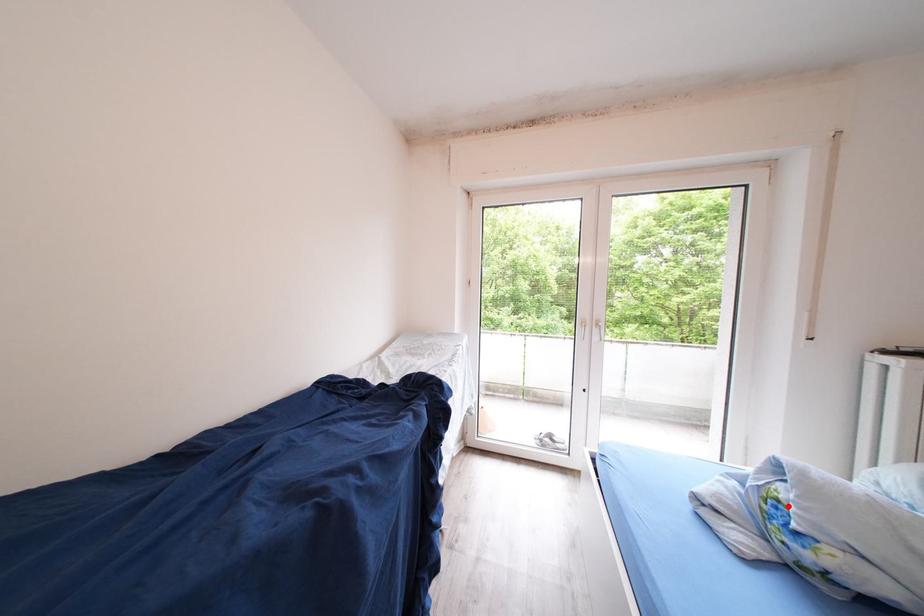
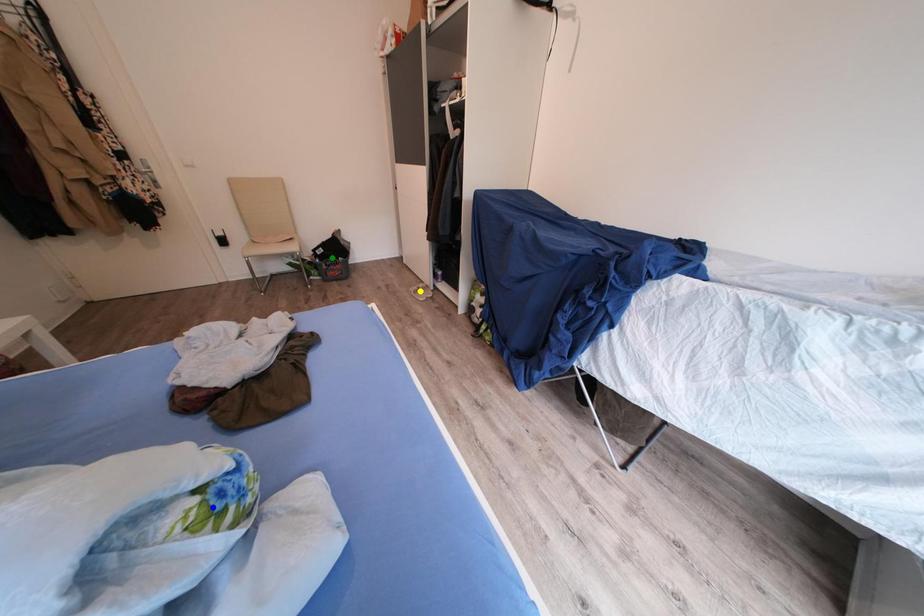
Question: I am providing you with two images of the same scene from different viewpoints. A red point is marked on the first image. You are given multiple points on the second image. Which spot in image 2 lines up with the point in image 1?

Choices:
 (A) blue point
 (B) green point
 (C) yellow point

Answer: (A)